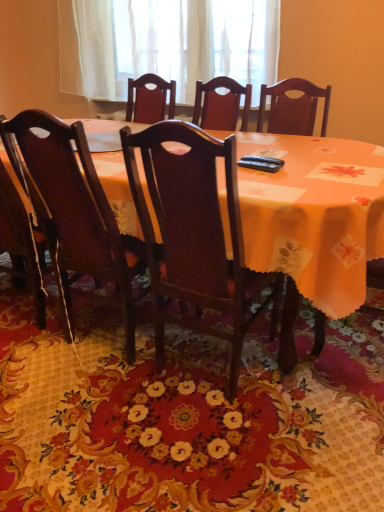
Question: Considering the relative positions of floral carpet at center and white sheer curtain at upper center in the image provided, is floral carpet at center to the left of white sheer curtain at upper center from the viewer's perspective?

Choices:
 (A) yes
 (B) no

Answer: (A)

Question: Is floral carpet at center to the right of white sheer curtain at upper center from the viewer's perspective?

Choices:
 (A) yes
 (B) no

Answer: (B)

Question: Does floral carpet at center touch white sheer curtain at upper center?

Choices:
 (A) yes
 (B) no

Answer: (B)

Question: From the image's perspective, would you say floral carpet at center is shown under white sheer curtain at upper center?

Choices:
 (A) no
 (B) yes

Answer: (B)

Question: Is white sheer curtain at upper center at the back of floral carpet at center?

Choices:
 (A) yes
 (B) no

Answer: (B)

Question: Is floral carpet at center oriented towards white sheer curtain at upper center?

Choices:
 (A) no
 (B) yes

Answer: (A)

Question: Is orange fabric table at center facing towards white sheer curtain at upper center?

Choices:
 (A) no
 (B) yes

Answer: (A)

Question: Considering the relative positions of orange fabric table at center and white sheer curtain at upper center in the image provided, is orange fabric table at center to the right of white sheer curtain at upper center from the viewer's perspective?

Choices:
 (A) no
 (B) yes

Answer: (B)

Question: Does orange fabric table at center have a lesser width compared to white sheer curtain at upper center?

Choices:
 (A) yes
 (B) no

Answer: (B)

Question: Can you confirm if orange fabric table at center is taller than white sheer curtain at upper center?

Choices:
 (A) no
 (B) yes

Answer: (B)

Question: From a real-world perspective, is orange fabric table at center located beneath white sheer curtain at upper center?

Choices:
 (A) no
 (B) yes

Answer: (B)

Question: Does orange fabric table at center have a smaller size compared to white sheer curtain at upper center?

Choices:
 (A) yes
 (B) no

Answer: (B)

Question: Is dark wood chair at center, placed as the 1th chair when sorted from right to left, facing towards white sheer curtain at upper center?

Choices:
 (A) yes
 (B) no

Answer: (B)